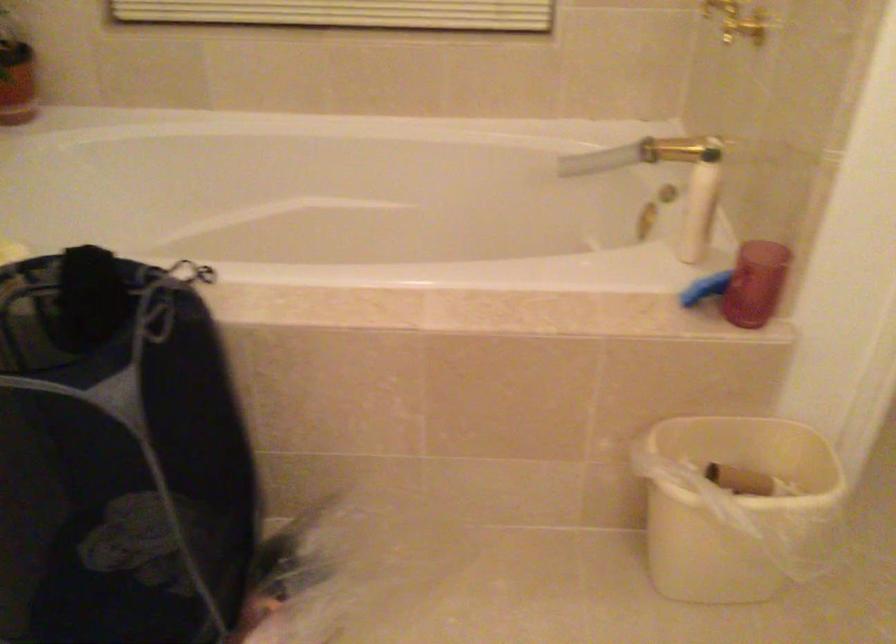
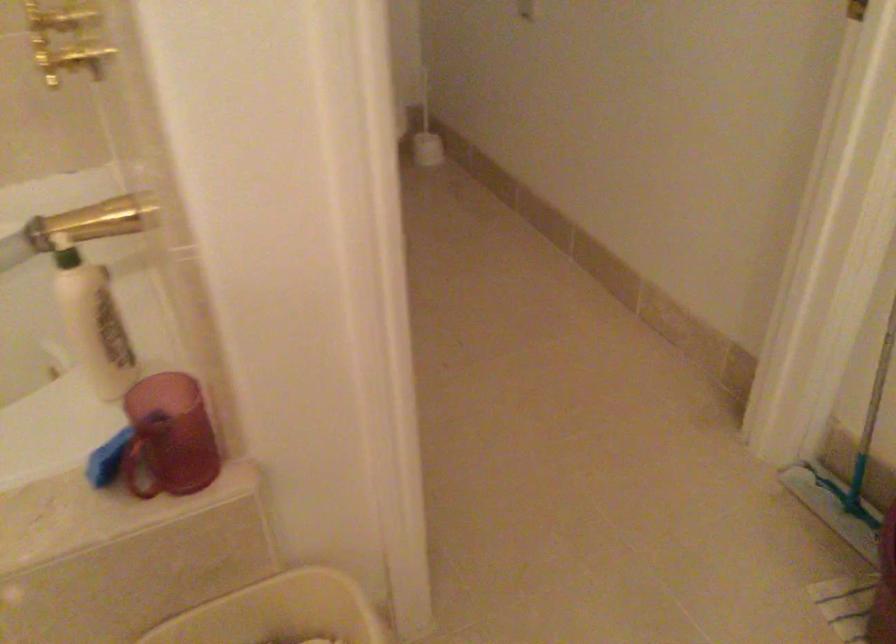
Question: The camera is either moving clockwise (left) or counter-clockwise (right) around the object. The first image is from the beginning of the video and the second image is from the end. Is the camera moving left or right when shooting the video?

Choices:
 (A) Left
 (B) Right

Answer: (A)